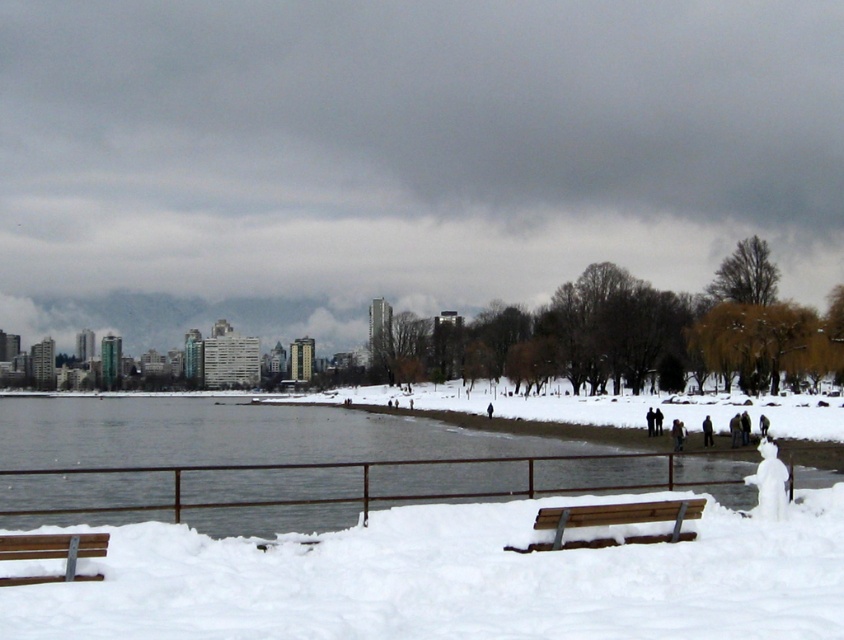
You are standing at the waterfront and notice the white fluffy snow at lower center. Based on its position, can you determine if it is closer to the metal railing or the city skyline in the background?

The white fluffy snow at lower center is located at point coordinates that place it closer to the metal railing than the city skyline in the background.